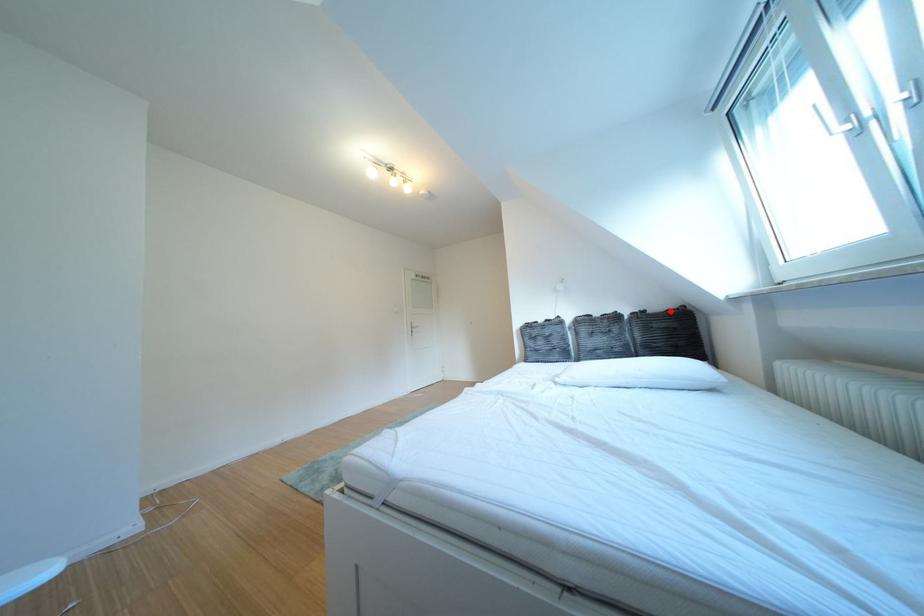
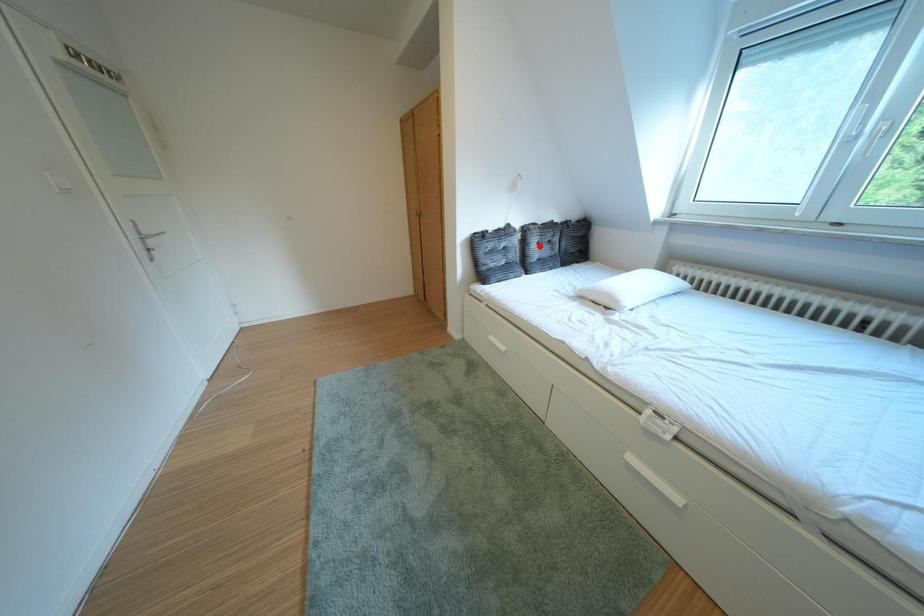
I am providing you with two images of the same scene from different viewpoints. A red point is marked on the first image and another point is marked on the second image. Does the point marked in image1 correspond to the same location as the one in image2?

No